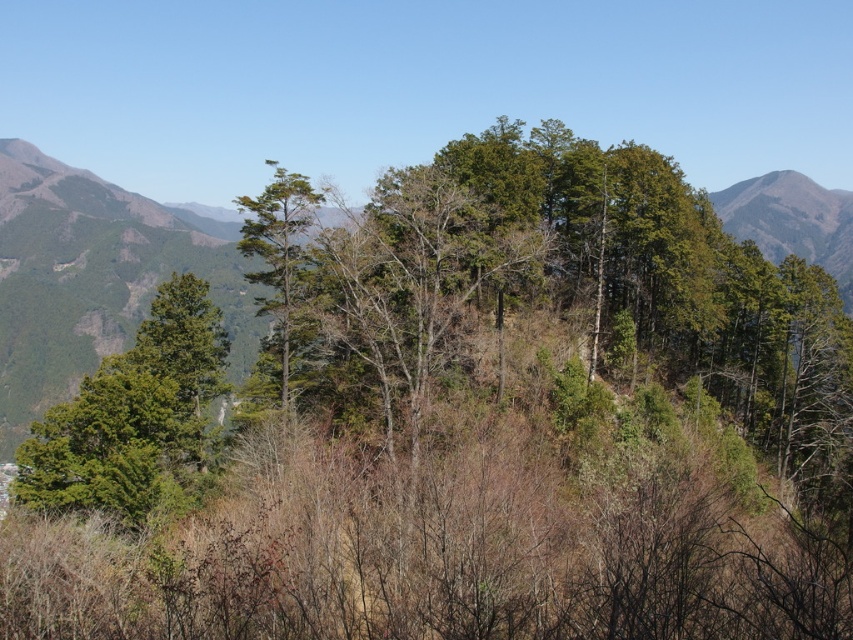
Is point (93, 307) farther from viewer compared to point (189, 316)?

That is True.

Does green leafy trees at upper left come behind green matte tree at left?

Yes, green leafy trees at upper left is behind green matte tree at left.

You are a GUI agent. You are given a task and a screenshot of the screen. Output one action in this format:
    pyautogui.click(x=<x>, y=<y>)
    Task: Click on the green leafy trees at upper left
    
    Given the screenshot: What is the action you would take?
    pyautogui.click(x=96, y=278)

You are a GUI agent. You are given a task and a screenshot of the screen. Output one action in this format:
    pyautogui.click(x=<x>, y=<y>)
    Task: Click on the green leafy trees at upper left
    
    Given the screenshot: What is the action you would take?
    pyautogui.click(x=96, y=278)

Does point (241, 296) lie in front of point (283, 179)?

No, it is behind (283, 179).

The width and height of the screenshot is (853, 640). Find the location of `green leafy trees at upper left`. green leafy trees at upper left is located at coordinates [x=96, y=278].

The height and width of the screenshot is (640, 853). Find the location of `green leafy trees at upper left`. green leafy trees at upper left is located at coordinates (96, 278).

Does green matte tree at left have a greater height compared to green matte tree at center?

No.

The width and height of the screenshot is (853, 640). What do you see at coordinates (132, 413) in the screenshot?
I see `green matte tree at left` at bounding box center [132, 413].

You are a GUI agent. You are given a task and a screenshot of the screen. Output one action in this format:
    pyautogui.click(x=<x>, y=<y>)
    Task: Click on the green matte tree at left
    
    Given the screenshot: What is the action you would take?
    pyautogui.click(x=132, y=413)

Identify the location of green matte tree at left. The height and width of the screenshot is (640, 853). click(132, 413).